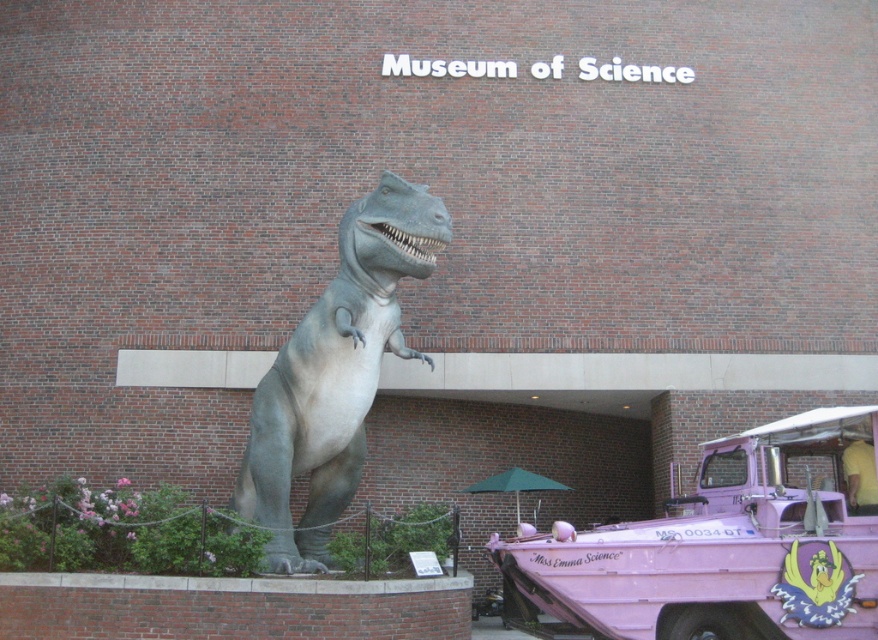
Does pink matte amphibious vehicle at lower right lie behind gray matte dinosaur at center?

No, pink matte amphibious vehicle at lower right is in front of gray matte dinosaur at center.

Is pink matte amphibious vehicle at lower right closer to camera compared to gray matte dinosaur at center?

Yes, it is in front of gray matte dinosaur at center.

Identify the location of pink matte amphibious vehicle at lower right. This screenshot has width=878, height=640. (725, 545).

The width and height of the screenshot is (878, 640). I want to click on pink matte amphibious vehicle at lower right, so click(725, 545).